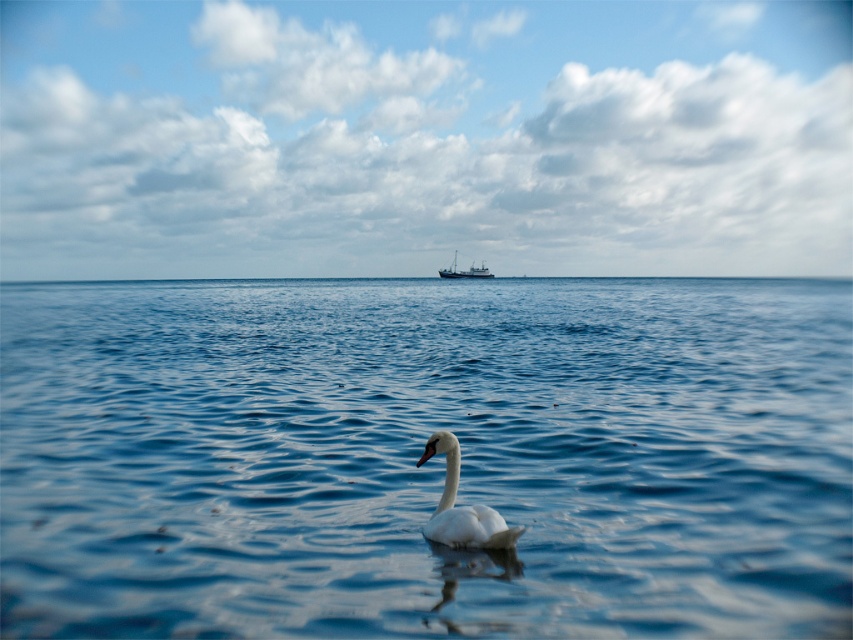
Question: Can you confirm if blue water at center is wider than white matte boat at center?

Choices:
 (A) yes
 (B) no

Answer: (A)

Question: Can you confirm if blue water at center is positioned below white matte boat at center?

Choices:
 (A) no
 (B) yes

Answer: (B)

Question: Can you confirm if blue water at center is positioned above white glossy swan at center?

Choices:
 (A) no
 (B) yes

Answer: (B)

Question: Among these objects, which one is farthest from the camera?

Choices:
 (A) white glossy swan at center
 (B) blue water at center
 (C) white matte boat at center

Answer: (C)

Question: Which point is farther to the camera?

Choices:
 (A) (480, 266)
 (B) (474, 545)
 (C) (283, 612)

Answer: (A)

Question: Which point is closer to the camera taking this photo?

Choices:
 (A) (802, 369)
 (B) (451, 266)

Answer: (A)